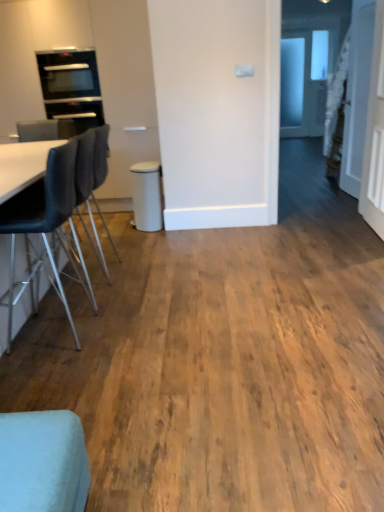
Question: Considering the relative sizes of white glossy door at upper right and black glass oven at upper left in the image provided, is white glossy door at upper right bigger than black glass oven at upper left?

Choices:
 (A) no
 (B) yes

Answer: (B)

Question: Considering the relative sizes of white glossy door at upper right and black glass oven at upper left in the image provided, is white glossy door at upper right shorter than black glass oven at upper left?

Choices:
 (A) no
 (B) yes

Answer: (A)

Question: Does white glossy door at upper right have a lesser width compared to black glass oven at upper left?

Choices:
 (A) yes
 (B) no

Answer: (A)

Question: From a real-world perspective, is white glossy door at upper right positioned under black glass oven at upper left based on gravity?

Choices:
 (A) yes
 (B) no

Answer: (A)

Question: Does white glossy door at upper right touch black glass oven at upper left?

Choices:
 (A) no
 (B) yes

Answer: (A)

Question: Can you confirm if white glossy door at upper right is positioned to the right of black glass oven at upper left?

Choices:
 (A) no
 (B) yes

Answer: (B)

Question: Does white glossy door at upper right have a larger size compared to light blue fabric chair at lower left, which ranks as the third chair in back-to-front order?

Choices:
 (A) yes
 (B) no

Answer: (A)

Question: Considering the relative sizes of white glossy door at upper right and light blue fabric chair at lower left, which ranks as the third chair in back-to-front order, in the image provided, is white glossy door at upper right taller than light blue fabric chair at lower left, which ranks as the third chair in back-to-front order,?

Choices:
 (A) no
 (B) yes

Answer: (B)

Question: Could you tell me if white glossy door at upper right is turned towards light blue fabric chair at lower left, marked as the first chair in a front-to-back arrangement?

Choices:
 (A) no
 (B) yes

Answer: (A)

Question: From the image's perspective, is white glossy door at upper right under light blue fabric chair at lower left, which ranks as the third chair in back-to-front order?

Choices:
 (A) yes
 (B) no

Answer: (B)

Question: Does white glossy door at upper right have a greater width compared to light blue fabric chair at lower left, which ranks as the third chair in back-to-front order?

Choices:
 (A) no
 (B) yes

Answer: (A)

Question: Does white glossy door at upper right have a lesser height compared to light blue fabric chair at lower left, which ranks as the third chair in back-to-front order?

Choices:
 (A) yes
 (B) no

Answer: (B)

Question: Is black glass oven at upper left thinner than black leather chair at left, the 3th chair in the front-to-back sequence?

Choices:
 (A) no
 (B) yes

Answer: (B)